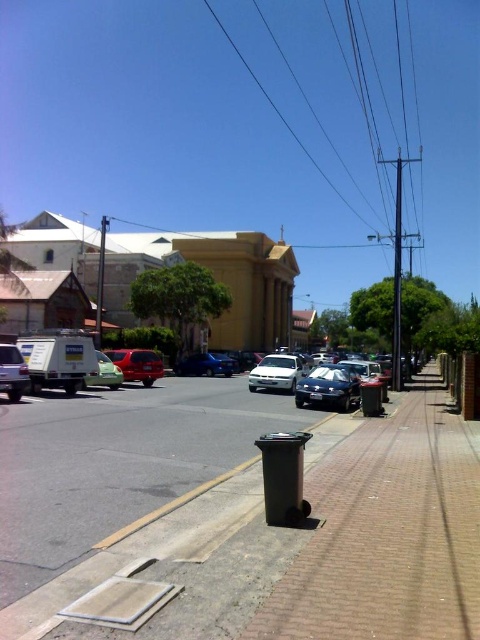
You are a delivery person standing at the point marked by the coordinates (280, 113) in the image. You need to deliver a package to the black trash bin on the sidewalk. Which direction should you walk to reach the trash bin?

The point marked by the coordinates (280, 113) indicates the black metallic power line at upper center. To reach the black trash bin on the sidewalk, you should walk downward from the power line towards the lower part of the image where the trash bin is located.

You are a delivery driver who needs to park your van, which is as wide as the white matte van at left, between the shiny blue sedan at center and the black trash bin on the sidewalk. Is there enough space?

The shiny blue sedan at center is positioned on the right side of white matte van at left. Since the white matte van at left is as wide as your van, and the space between them is available, you can park your van there.

You are a city planner reviewing this street layout. You need to install a new streetlight pole that must be placed exactly at the position of the black metallic power line at upper center. What are the coordinates where the pole should be installed?

The black metallic power line at upper center is located at point (x=280, y=113), so the streetlight pole should be installed at coordinates (x=280, y=113).